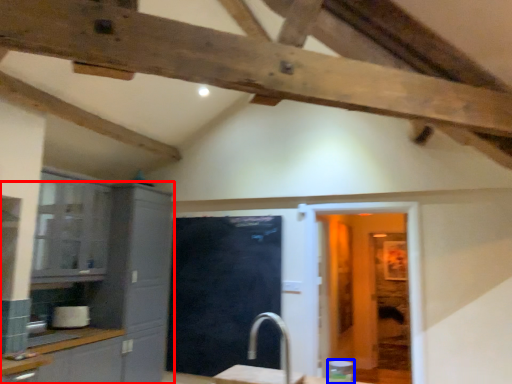
Question: Which object is further to the camera taking this photo, cabinetry (highlighted by a red box) or appliance (highlighted by a blue box)?

Choices:
 (A) cabinetry
 (B) appliance

Answer: (A)